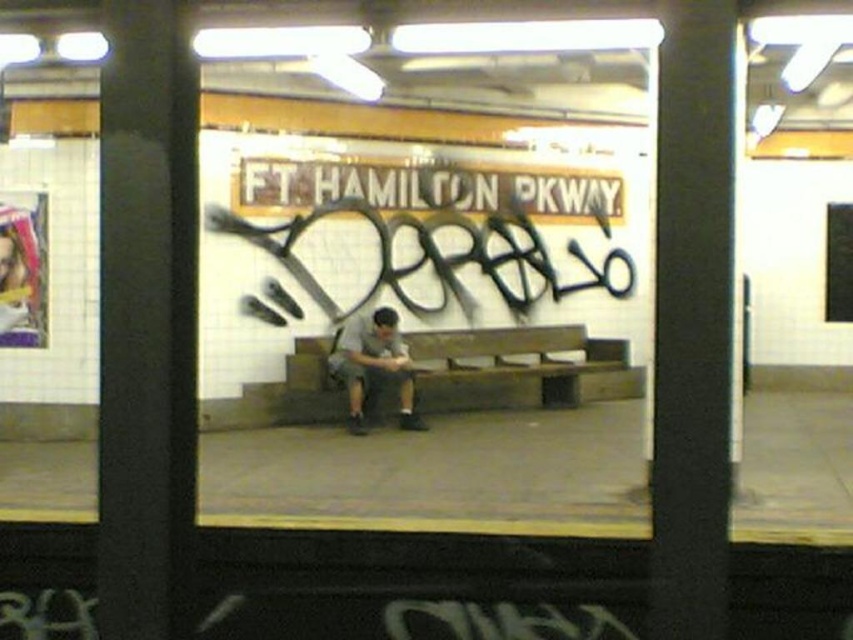
Can you confirm if wooden bench at center is wider than gray fabric shirt at center?

Yes.

Does wooden bench at center appear on the right side of gray fabric shirt at center?

Indeed, wooden bench at center is positioned on the right side of gray fabric shirt at center.

Who is more forward, (524, 387) or (357, 396)?

Point (357, 396) is in front.

The height and width of the screenshot is (640, 853). Find the location of `wooden bench at center`. wooden bench at center is located at coordinates (511, 365).